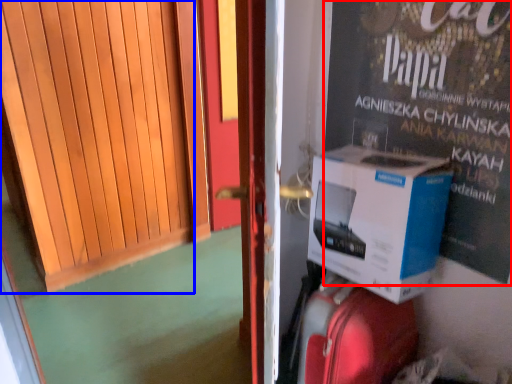
Question: Which object appears closest to the camera in this image, advertisement (highlighted by a red box) or door (highlighted by a blue box)?

Choices:
 (A) advertisement
 (B) door

Answer: (B)